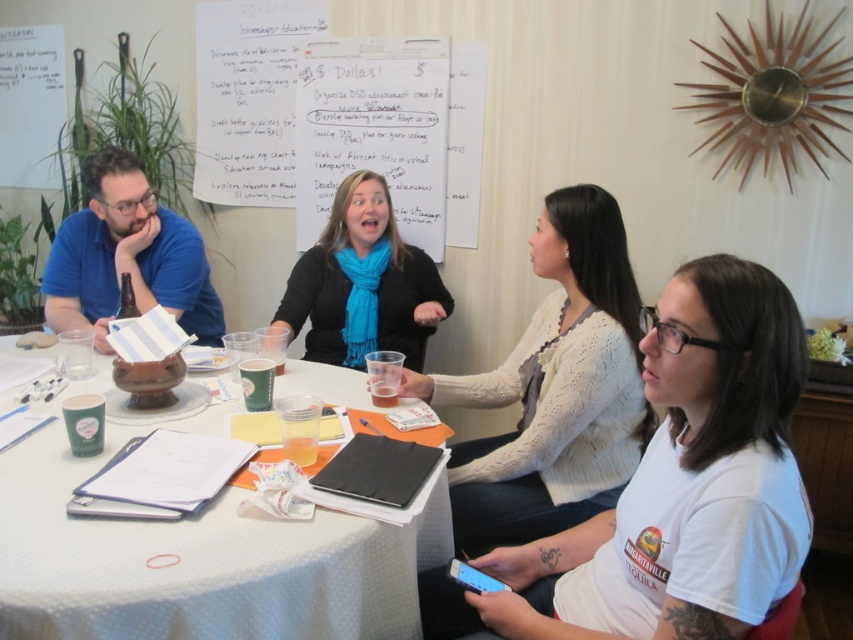
Question: Does white cotton shirt at lower right appear over white paper at center?

Choices:
 (A) yes
 (B) no

Answer: (A)

Question: Which point is farther from the camera taking this photo?

Choices:
 (A) (596, 273)
 (B) (726, 563)
 (C) (223, 579)

Answer: (A)

Question: In this image, where is white paper at center located relative to white knitted sweater at center?

Choices:
 (A) below
 (B) above

Answer: (A)

Question: Among these points, which one is farthest from the camera?

Choices:
 (A) (428, 554)
 (B) (519, 449)
 (C) (347, 340)

Answer: (C)

Question: Which object is the closest to the white knitted sweater at center?

Choices:
 (A) white paper at center
 (B) white cotton shirt at lower right

Answer: (A)

Question: Does white cotton shirt at lower right come behind blue scarf at center?

Choices:
 (A) yes
 (B) no

Answer: (B)